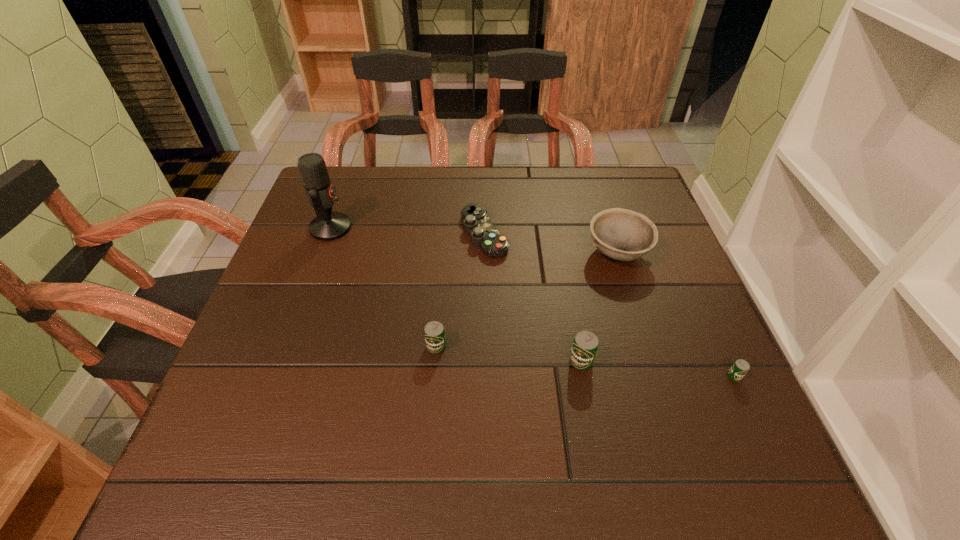
The height and width of the screenshot is (540, 960). I want to click on the third shortest object, so click(434, 332).

In order to click on the leftmost beer can in this screenshot , I will do `click(434, 332)`.

This screenshot has height=540, width=960. I want to click on the second beer can from left to right, so click(x=585, y=345).

Where is `the rightmost beer can`? This screenshot has width=960, height=540. the rightmost beer can is located at coordinates (739, 369).

This screenshot has width=960, height=540. In order to click on the shortest beer can in this screenshot , I will do `click(739, 369)`.

The image size is (960, 540). I want to click on control, so click(476, 223).

Find the location of a particular element. the tallest object is located at coordinates (328, 225).

Where is `the leftmost object`? The image size is (960, 540). the leftmost object is located at coordinates (328, 225).

Where is `bowl`? bowl is located at coordinates (620, 234).

Identify the location of vacant point located 0.180m on the back of the second tallest beer can. This screenshot has width=960, height=540. (443, 275).